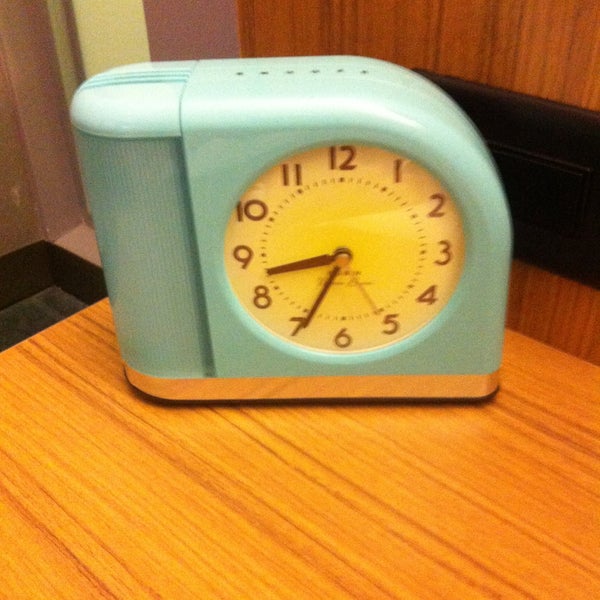
Image resolution: width=600 pixels, height=600 pixels. Identify the location of floor. 43,273.